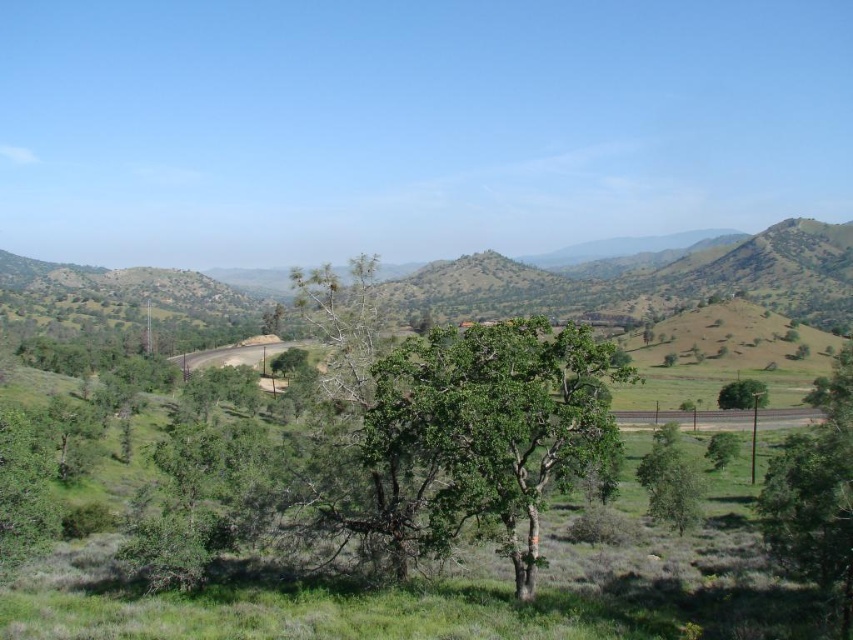
You are standing in the middle of the winding road and see the green leafy tree at lower left and the green leafy tree at right. Which tree is positioned more to the east if the road is oriented north to south?

The green leafy tree at lower left is positioned more to the east because it is to the left of the green leafy tree at right, and since the road is oriented north to south, the left side would correspond to the east direction.

You are standing at the center of the image and want to walk towards the green leafy tree at center. Which direction should you face to head directly towards it?

Since the green leafy tree at center is located at point coordinates, you should face the center direction to walk directly towards it.

You are standing at a point in the landscape and want to reach a specific location marked by point (16, 470). Given that you can walk at a speed of 3 feet per second, how many seconds will it take you to reach that point?

The distance between point (16, 470) and the camera is 95.82 feet. At a walking speed of 3 feet per second, it will take 95.82 divided by 3, which is approximately 31.94 seconds to reach the point.